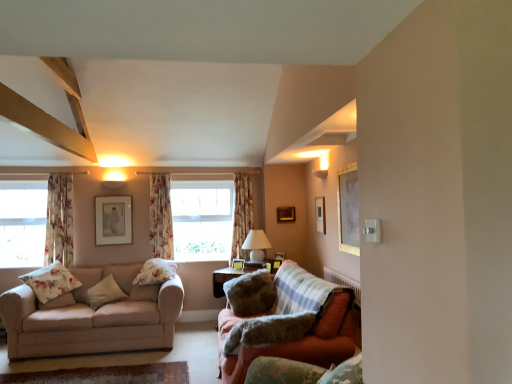
What is the approximate height of wooden picture frame at center, which is the 2th picture frame in front-to-back order?

The height of wooden picture frame at center, which is the 2th picture frame in front-to-back order, is 5.97 inches.

How much space does velvet orange couch at lower right, which is counted as the 1th studio couch, starting from the right, occupy vertically?

91.39 centimeters.

This screenshot has height=384, width=512. I want to click on wooden picture frame at center, positioned as the 2th picture frame in left-to-right order, so click(238, 264).

Describe the element at coordinates (241, 215) in the screenshot. I see `floral fabric curtain at center, acting as the first curtain starting from the back` at that location.

This screenshot has width=512, height=384. I want to click on beige fabric couch at left, the 1th studio couch positioned from the left, so click(x=92, y=318).

At what (x,y) coordinates should I click in order to perform the action: click on white glossy table lamp at center. Please return your answer as a coordinate pair (x, y). Looking at the image, I should click on (256, 245).

Measure the distance between fluffy brown pillow at center, marked as the sixth pillow in a left-to-right arrangement, and camera.

A distance of 9.08 feet exists between fluffy brown pillow at center, marked as the sixth pillow in a left-to-right arrangement, and camera.

What do you see at coordinates (268, 331) in the screenshot? This screenshot has height=384, width=512. I see `fluffy brown pillow at center, the first pillow from the right` at bounding box center [268, 331].

Locate an element on the screen. This screenshot has height=384, width=512. wooden picture frame at center, which is the 2th picture frame in front-to-back order is located at coordinates (276, 264).

Consider the image. Which object is positioned more to the right, beige fabric couch at left, which appears as the second studio couch when viewed from the right, or floral fabric curtain at center, the second curtain positioned from the back?

Positioned to the right is floral fabric curtain at center, the second curtain positioned from the back.

From a real-world perspective, is beige fabric couch at left, the 1th studio couch positioned from the left, located beneath floral fabric curtain at center, which ranks as the 2th curtain in right-to-left order?

Yes, from a real-world perspective, beige fabric couch at left, the 1th studio couch positioned from the left, is under floral fabric curtain at center, which ranks as the 2th curtain in right-to-left order.

Is beige fabric couch at left, which appears as the second studio couch when viewed from the right, looking in the opposite direction of floral fabric curtain at center, which ranks as the 2th curtain in right-to-left order?

No, floral fabric curtain at center, which ranks as the 2th curtain in right-to-left order, is not at the back of beige fabric couch at left, which appears as the second studio couch when viewed from the right.

Can you tell me how much wooden picture frame at upper center, the 1th picture frame when ordered from back to front, and matte silver picture frame at upper center, the fifth picture frame when ordered from front to back, differ in facing direction?

They differ by 0.328 degrees in their facing directions.

Is matte silver picture frame at upper center, the 2th picture frame in the back-to-front sequence, at the back of wooden picture frame at upper center, which ranks as the fifth picture frame in left-to-right order?

No, wooden picture frame at upper center, which ranks as the fifth picture frame in left-to-right order,'s orientation is not away from matte silver picture frame at upper center, the 2th picture frame in the back-to-front sequence.

Is wooden picture frame at upper center, the 1th picture frame when ordered from back to front, inside or outside of matte silver picture frame at upper center, the 2th picture frame in the back-to-front sequence?

wooden picture frame at upper center, the 1th picture frame when ordered from back to front, is not inside matte silver picture frame at upper center, the 2th picture frame in the back-to-front sequence, it's outside.

Where is `picture frame that is the 1st one when counting downward from the wooden picture frame at upper center, which ranks as the fifth picture frame in left-to-right order (from the image's perspective)`? picture frame that is the 1st one when counting downward from the wooden picture frame at upper center, which ranks as the fifth picture frame in left-to-right order (from the image's perspective) is located at coordinates (113, 220).

Does floral fabric pillow at center, arranged as the fourth pillow when viewed from the left, have a greater width compared to floral fabric curtain at center, which is the 3th curtain in left-to-right order?

Indeed, floral fabric pillow at center, arranged as the fourth pillow when viewed from the left, has a greater width compared to floral fabric curtain at center, which is the 3th curtain in left-to-right order.

Between point (141, 269) and point (233, 225), which one is positioned behind?

The point (233, 225) is farther.

How different are the orientations of floral fabric pillow at center, arranged as the fourth pillow when viewed from the left, and floral fabric curtain at center, which is the third curtain in front-to-back order, in degrees?

20.9 degrees.

What's the angular difference between wooden picture frame at center, marked as the fourth picture frame in a front-to-back arrangement, and floral fabric curtain at center, marked as the second curtain in a left-to-right arrangement,'s facing directions?

They differ by 44.5 degrees in their facing directions.

From the image's perspective, does wooden picture frame at center, positioned as the 2th picture frame in left-to-right order, appear lower than floral fabric curtain at center, the second curtain positioned from the back?

Correct, wooden picture frame at center, positioned as the 2th picture frame in left-to-right order, appears lower than floral fabric curtain at center, the second curtain positioned from the back, in the image.

Is wooden picture frame at center, marked as the fourth picture frame in a front-to-back arrangement, wider than floral fabric curtain at center, the second curtain positioned from the back?

No.

Which of these two, wooden picture frame at center, acting as the third picture frame starting from the back, or floral fabric curtain at center, the second curtain positioned from the back, stands taller?

floral fabric curtain at center, the second curtain positioned from the back.

From a real-world perspective, who is located higher, fluffy brown pillow at center, the first pillow from the right, or transparent glass window at left?

transparent glass window at left, from a real-world perspective.

Considering the relative sizes of fluffy brown pillow at center, marked as the sixth pillow in a left-to-right arrangement, and transparent glass window at left in the image provided, is fluffy brown pillow at center, marked as the sixth pillow in a left-to-right arrangement, thinner than transparent glass window at left?

In fact, fluffy brown pillow at center, marked as the sixth pillow in a left-to-right arrangement, might be wider than transparent glass window at left.

Are fluffy brown pillow at center, the first pillow from the right, and transparent glass window at left beside each other?

No, fluffy brown pillow at center, the first pillow from the right, is not with transparent glass window at left.

Considering the positions of objects fluffy brown pillow at center, marked as the sixth pillow in a left-to-right arrangement, and transparent glass window at left in the image provided, who is more to the left, fluffy brown pillow at center, marked as the sixth pillow in a left-to-right arrangement, or transparent glass window at left?

transparent glass window at left.

How different are the orientations of floral fabric curtain at center, which is the third curtain in front-to-back order, and floral fabric pillow at left, which is the first pillow from left to right, in degrees?

30.8 degrees separate the facing orientations of floral fabric curtain at center, which is the third curtain in front-to-back order, and floral fabric pillow at left, which is the first pillow from left to right.

Considering the positions of point (252, 213) and point (35, 270), is point (252, 213) closer or farther from the camera than point (35, 270)?

Point (252, 213) is positioned farther from the camera compared to point (35, 270).

Is floral fabric curtain at center, which is the 3th curtain in left-to-right order, looking in the opposite direction of floral fabric pillow at left, which is the first pillow from left to right?

No.

From their relative heights in the image, would you say floral fabric curtain at center, placed as the 1th curtain when sorted from right to left, is taller or shorter than floral fabric pillow at left, the 6th pillow when ordered from right to left?

In the image, floral fabric curtain at center, placed as the 1th curtain when sorted from right to left, appears to be taller than floral fabric pillow at left, the 6th pillow when ordered from right to left.

Between fluffy brown pillow at center, marked as the sixth pillow in a left-to-right arrangement, and velvet orange couch at lower right, acting as the 2th studio couch starting from the left, which one has larger size?

Bigger between the two is velvet orange couch at lower right, acting as the 2th studio couch starting from the left.

Between fluffy brown pillow at center, marked as the sixth pillow in a left-to-right arrangement, and velvet orange couch at lower right, which is counted as the 1th studio couch, starting from the right, which one has more height?

With more height is velvet orange couch at lower right, which is counted as the 1th studio couch, starting from the right.

Does point (305, 326) appear closer or farther from the camera than point (318, 329)?

Clearly, point (305, 326) is closer to the camera than point (318, 329).

There is a beige fabric couch at left, the 1th studio couch positioned from the left. At what (x,y) coordinates should I click in order to perform the action: click on the 3rd curtain above it (from a real-world perspective). Please return your answer as a coordinate pair (x, y). Looking at the image, I should click on (161, 217).

Locate an element on the screen. The image size is (512, 384). picture frame that is the 1st one when counting upward from the matte silver picture frame at upper center, the fifth picture frame when ordered from front to back (from the image's perspective) is located at coordinates click(x=286, y=214).

Based on their spatial positions, is beige fabric pillow at left, the 3th pillow in the left-to-right sequence, or velvet orange couch at lower right, which is counted as the 1th studio couch, starting from the right, further from fluffy beige pillow at center, the second pillow viewed from the right?

Based on the image, beige fabric pillow at left, the 3th pillow in the left-to-right sequence, appears to be further to fluffy beige pillow at center, the second pillow viewed from the right.

Looking at the image, which one is located further to wooden picture frame at center, the 3th picture frame positioned from the front, floral fabric pillow at center, arranged as the fourth pillow when viewed from the left, or wooden picture frame at upper center, the sixth picture frame viewed from the left?

floral fabric pillow at center, arranged as the fourth pillow when viewed from the left, lies further to wooden picture frame at center, the 3th picture frame positioned from the front, than the other object.

From the image, which object appears to be nearer to wooden picture frame at center, placed as the 4th picture frame when sorted from right to left, beige fabric couch at left, which appears as the second studio couch when viewed from the right, or fluffy beige pillow at center, which is counted as the 5th pillow, starting from the left?

fluffy beige pillow at center, which is counted as the 5th pillow, starting from the left, is closer to wooden picture frame at center, placed as the 4th picture frame when sorted from right to left.

Looking at the image, which one is located further to transparent glass window at left, floral fabric curtain at center, which ranks as the 2th curtain in right-to-left order, or wooden picture frame at center, which ranks as the third picture frame in left-to-right order?

wooden picture frame at center, which ranks as the third picture frame in left-to-right order, is further to transparent glass window at left.

Which object lies further to the anchor point wooden picture frame at center, positioned as the 2th picture frame in left-to-right order, wooden picture frame at upper center, which appears as the 6th picture frame when viewed from the front, or fluffy beige pillow at left, the second pillow viewed from the left?

fluffy beige pillow at left, the second pillow viewed from the left, is further to wooden picture frame at center, positioned as the 2th picture frame in left-to-right order.

Based on the photo, when comparing their distances from wooden picture frame at center, positioned as the 5th picture frame in right-to-left order, does floral fabric curtain at left, which is the 1th curtain from front to back, or velvet orange couch at lower right, which is counted as the 1th studio couch, starting from the right, seem closer?

floral fabric curtain at left, which is the 1th curtain from front to back, lies closer to wooden picture frame at center, positioned as the 5th picture frame in right-to-left order, than the other object.

Estimate the real-world distances between objects in this image. Which object is closer to floral fabric curtain at left, which appears as the first curtain when viewed from the left, velvet green armchair at lower right or floral fabric pillow at left, the 6th pillow when ordered from right to left?

floral fabric pillow at left, the 6th pillow when ordered from right to left, lies closer to floral fabric curtain at left, which appears as the first curtain when viewed from the left, than the other object.

Estimate the real-world distances between objects in this image. Which object is closer to floral fabric curtain at center, which ranks as the 2th curtain in right-to-left order, velvet orange couch at lower right, which is counted as the 1th studio couch, starting from the right, or beige fabric pillow at left, the 3th pillow in the left-to-right sequence?

Among the two, beige fabric pillow at left, the 3th pillow in the left-to-right sequence, is located nearer to floral fabric curtain at center, which ranks as the 2th curtain in right-to-left order.

What are the coordinates of `studio couch between floral fabric curtain at left, which is the 1th curtain from front to back, and floral fabric pillow at center, the third pillow from the right, from left to right` in the screenshot? It's located at (92, 318).

Where is `picture frame located between matte silver picture frame at upper center, the 2th picture frame in the back-to-front sequence, and fluffy beige pillow at center, which is counted as the 5th pillow, starting from the left, in the left-right direction`? picture frame located between matte silver picture frame at upper center, the 2th picture frame in the back-to-front sequence, and fluffy beige pillow at center, which is counted as the 5th pillow, starting from the left, in the left-right direction is located at coordinates (238, 264).

The image size is (512, 384). I want to click on pillow between beige fabric pillow at left, marked as the fourth pillow in a right-to-left arrangement, and fluffy beige pillow at center, the second pillow viewed from the right, from left to right, so click(x=156, y=272).

In order to click on table lamp between fluffy beige pillow at left, the fifth pillow positioned from the right, and wooden picture frame at center, the fourth picture frame viewed from the left, in the horizontal direction in this screenshot , I will do `click(256, 245)`.